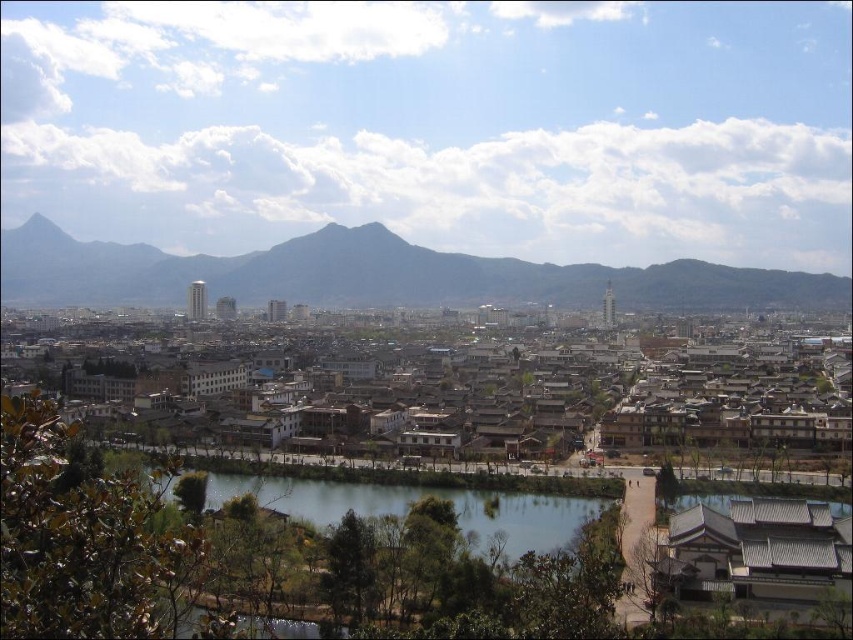
Question: Can you confirm if matte gray mountain at center is positioned below green smooth water at center?

Choices:
 (A) no
 (B) yes

Answer: (A)

Question: Which object appears closest to the camera in this image?

Choices:
 (A) matte gray mountain at center
 (B) green smooth water at center

Answer: (B)

Question: Is matte gray mountain at center closer to the viewer compared to green smooth water at center?

Choices:
 (A) yes
 (B) no

Answer: (B)

Question: Does matte gray mountain at center have a larger size compared to green smooth water at center?

Choices:
 (A) yes
 (B) no

Answer: (A)